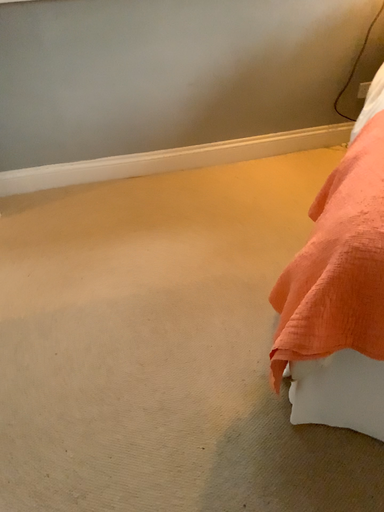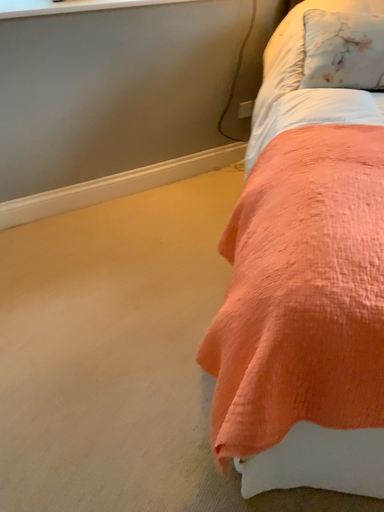
Question: Which way did the camera rotate in the video?

Choices:
 (A) rotated left
 (B) rotated right

Answer: (B)